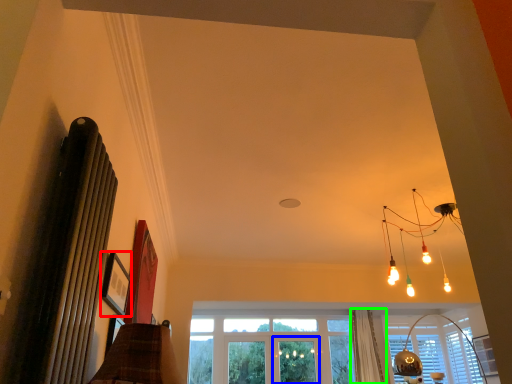
Question: Considering the real-world distances, which object is closest to picture frame (highlighted by a red box)? screen door (highlighted by a blue box) or curtain (highlighted by a green box).

Choices:
 (A) screen door
 (B) curtain

Answer: (B)